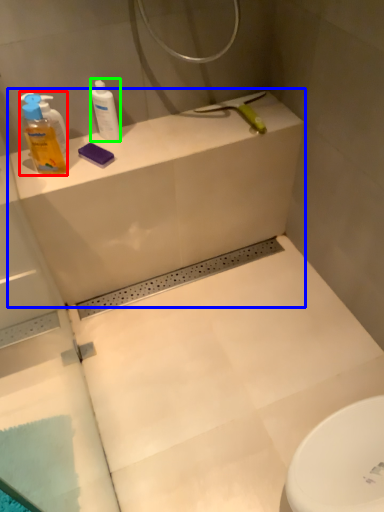
Question: Considering the real-world distances, which object is farthest from cleaning product (highlighted by a red box)? counter top (highlighted by a blue box) or cleaning product (highlighted by a green box)?

Choices:
 (A) counter top
 (B) cleaning product

Answer: (A)